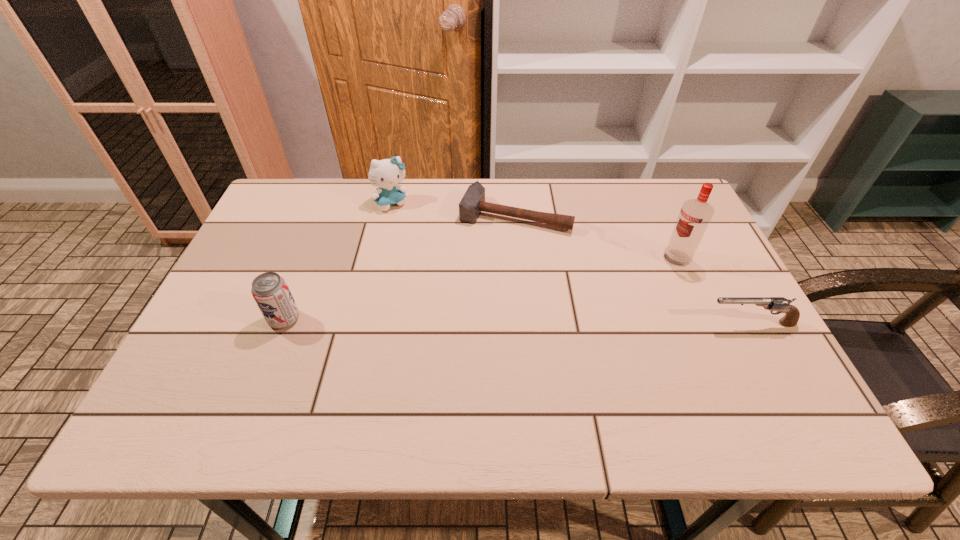
At what (x,y) coordinates should I click in order to perform the action: click on the third tallest object. Please return your answer as a coordinate pair (x, y). Looking at the image, I should click on (270, 291).

Locate an element on the screen. This screenshot has width=960, height=540. beer can is located at coordinates pos(270,291).

Locate an element on the screen. the fourth tallest object is located at coordinates (780, 304).

Identify the location of hammer. The image size is (960, 540). (473, 202).

Where is `the shortest object`? The image size is (960, 540). the shortest object is located at coordinates (473, 202).

Locate an element on the screen. This screenshot has width=960, height=540. kitten is located at coordinates (385, 174).

Where is `the fourth object from right to left`? This screenshot has width=960, height=540. the fourth object from right to left is located at coordinates (385, 174).

Where is `the third farthest object`? The image size is (960, 540). the third farthest object is located at coordinates (695, 215).

Identify the location of vodka. (695, 215).

Where is `vacant area situated 0.250m on the right of the leftmost object`? The image size is (960, 540). vacant area situated 0.250m on the right of the leftmost object is located at coordinates (406, 319).